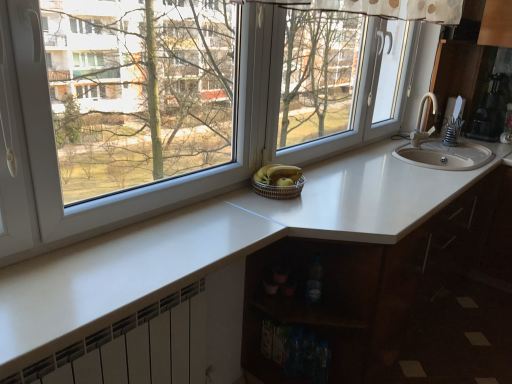
Question: From the image's perspective, is white glossy countertop at center above or below woven brown basket at center?

Choices:
 (A) below
 (B) above

Answer: (A)

Question: Is white glossy countertop at center situated inside woven brown basket at center or outside?

Choices:
 (A) outside
 (B) inside

Answer: (A)

Question: Which is nearer to the white glossy countertop at center?

Choices:
 (A) transparent glass window at center
 (B) metallic silver coffee maker at upper right
 (C) translucent plastic bottle at lower center
 (D) woven brown basket at center
 (E) yellow matte bananas at center

Answer: (C)

Question: Estimate the real-world distances between objects in this image. Which object is farther from the yellow matte bananas at center?

Choices:
 (A) white metallic radiator at lower left
 (B) white glossy countertop at center
 (C) metallic silver coffee maker at upper right
 (D) translucent plastic bottle at lower center
 (E) woven brown basket at center

Answer: (C)